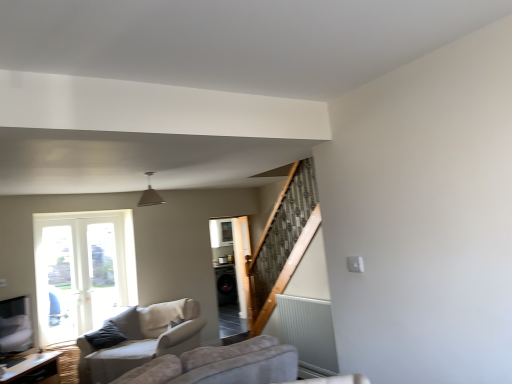
Question: Is beige fabric couch at lower left thinner than black glossy screen door at center?

Choices:
 (A) yes
 (B) no

Answer: (B)

Question: Can you confirm if beige fabric couch at lower left is positioned to the left of black glossy screen door at center?

Choices:
 (A) yes
 (B) no

Answer: (A)

Question: From the image's perspective, is beige fabric couch at lower left below black glossy screen door at center?

Choices:
 (A) no
 (B) yes

Answer: (B)

Question: Does beige fabric couch at lower left lie in front of black glossy screen door at center?

Choices:
 (A) yes
 (B) no

Answer: (A)

Question: Considering the relative sizes of beige fabric couch at lower left and black glossy screen door at center in the image provided, is beige fabric couch at lower left taller than black glossy screen door at center?

Choices:
 (A) no
 (B) yes

Answer: (A)

Question: Is black glossy screen door at center completely or partially inside beige fabric couch at lower left?

Choices:
 (A) yes
 (B) no

Answer: (B)

Question: From a real-world perspective, is beige fabric couch at lower left physically above matte gray pendant light at center?

Choices:
 (A) no
 (B) yes

Answer: (A)

Question: Is beige fabric couch at lower left shorter than matte gray pendant light at center?

Choices:
 (A) no
 (B) yes

Answer: (A)

Question: Does beige fabric couch at lower left have a larger size compared to matte gray pendant light at center?

Choices:
 (A) yes
 (B) no

Answer: (A)

Question: Is the depth of beige fabric couch at lower left greater than that of matte gray pendant light at center?

Choices:
 (A) no
 (B) yes

Answer: (B)

Question: Is beige fabric couch at lower left positioned in front of matte gray pendant light at center?

Choices:
 (A) no
 (B) yes

Answer: (A)

Question: Is beige fabric couch at lower left aimed at matte gray pendant light at center?

Choices:
 (A) yes
 (B) no

Answer: (B)

Question: From the image's perspective, does matte gray pendant light at center appear lower than wooden table at lower left?

Choices:
 (A) yes
 (B) no

Answer: (B)